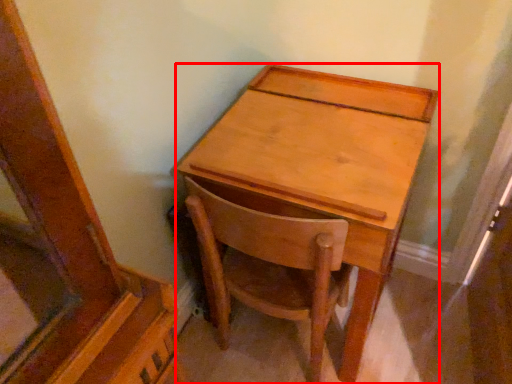
Question: From the image's perspective, considering the relative positions of desk (annotated by the red box) and chair in the image provided, where is desk (annotated by the red box) located with respect to the staircase?

Choices:
 (A) above
 (B) below

Answer: (A)